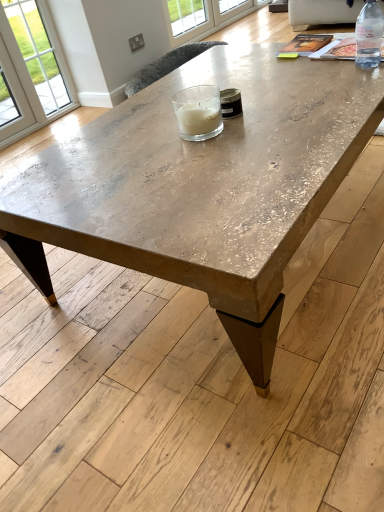
Question: Is clear glass window at upper center in front of or behind beige fabric couch at upper right in the image?

Choices:
 (A) front
 (B) behind

Answer: (B)

Question: In terms of height, does clear glass window at upper center look taller or shorter compared to beige fabric couch at upper right?

Choices:
 (A) short
 (B) tall

Answer: (B)

Question: Estimate the real-world distances between objects in this image. Which object is closer to the beige fabric couch at upper right?

Choices:
 (A) clear glass window at upper center
 (B) clear glass candle at center
 (C) clear plastic bottle at upper right
 (D) distressed wood coffee table at center

Answer: (A)

Question: Which object is the farthest from the clear glass candle at center?

Choices:
 (A) clear plastic bottle at upper right
 (B) distressed wood coffee table at center
 (C) clear glass window at upper center
 (D) beige fabric couch at upper right

Answer: (D)